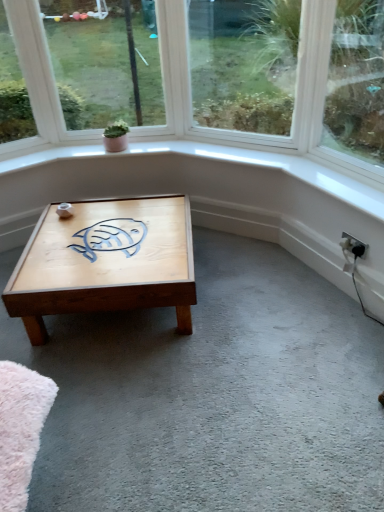
Where is `free space to the left of green matte plant at upper center`? The width and height of the screenshot is (384, 512). free space to the left of green matte plant at upper center is located at coordinates (86, 153).